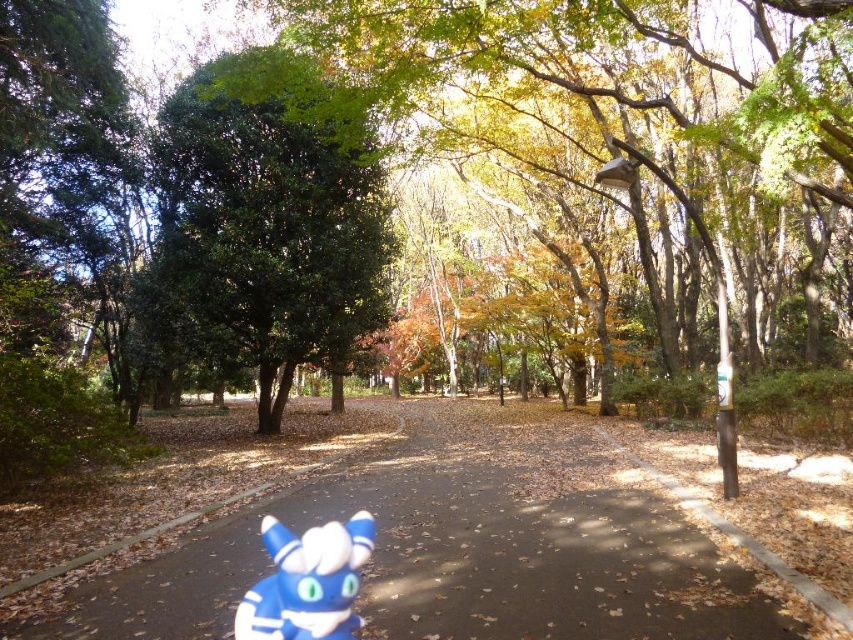
Question: Is brown asphalt path at center positioned at the back of blue rubber toy at center?

Choices:
 (A) no
 (B) yes

Answer: (B)

Question: Among these points, which one is farthest from the camera?

Choices:
 (A) (236, 182)
 (B) (689, 454)
 (C) (323, 636)

Answer: (A)

Question: Is brown asphalt path at center to the right of green leafy tree at center from the viewer's perspective?

Choices:
 (A) yes
 (B) no

Answer: (A)

Question: Which point is closer to the camera?

Choices:
 (A) brown asphalt path at center
 (B) green leafy tree at center
 (C) blue rubber toy at center

Answer: (C)

Question: Is brown asphalt path at center to the right of green leafy tree at center from the viewer's perspective?

Choices:
 (A) no
 (B) yes

Answer: (B)

Question: Which object is closer to the camera taking this photo?

Choices:
 (A) green leafy tree at center
 (B) blue rubber toy at center

Answer: (B)